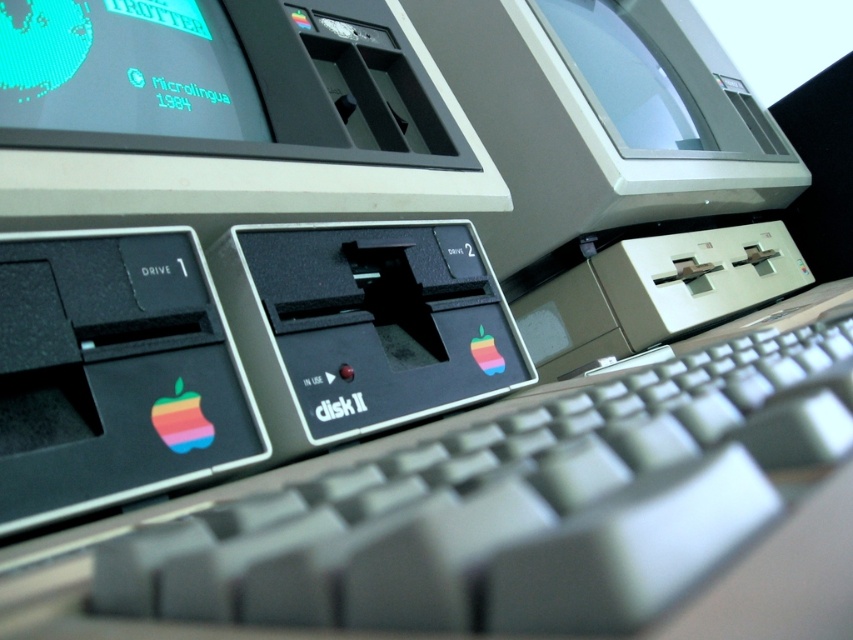
Question: Estimate the real-world distances between objects in this image. Which object is closer to the teal matte screen at upper left?

Choices:
 (A) transparent plastic monitor at upper center
 (B) gray plastic keyboard at center

Answer: (B)

Question: Can you confirm if teal matte screen at upper left is smaller than transparent plastic monitor at upper center?

Choices:
 (A) yes
 (B) no

Answer: (A)

Question: Is gray plastic keyboard at center to the left of transparent plastic monitor at upper center from the viewer's perspective?

Choices:
 (A) yes
 (B) no

Answer: (A)

Question: Does gray plastic keyboard at center appear under teal matte screen at upper left?

Choices:
 (A) no
 (B) yes

Answer: (B)

Question: Among these objects, which one is farthest from the camera?

Choices:
 (A) transparent plastic monitor at upper center
 (B) gray plastic keyboard at center

Answer: (A)

Question: Which object is closer to the camera taking this photo?

Choices:
 (A) gray plastic keyboard at center
 (B) transparent plastic monitor at upper center
 (C) teal matte screen at upper left

Answer: (A)